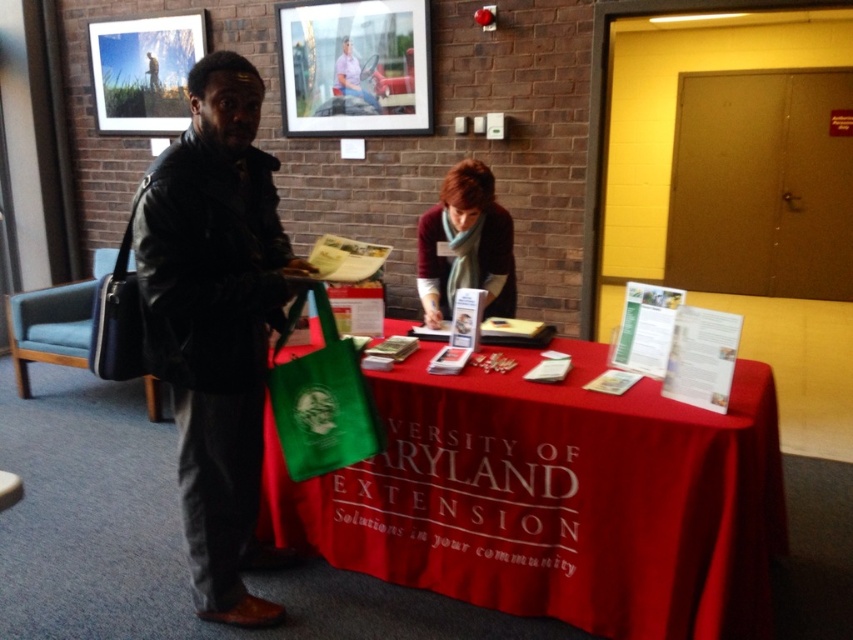
Question: Which object is positioned farthest from the maroon sweater at center?

Choices:
 (A) leather jacket at left
 (B) red cloth at center

Answer: (A)

Question: Which point is closer to the camera?

Choices:
 (A) leather jacket at left
 (B) red cloth at center
 (C) green fabric bag at center

Answer: (A)

Question: Can you confirm if red cloth at center is positioned to the left of leather jacket at left?

Choices:
 (A) yes
 (B) no

Answer: (B)

Question: Which object is positioned closest to the leather jacket at left?

Choices:
 (A) maroon sweater at center
 (B) green fabric bag at center
 (C) red cloth at center

Answer: (B)

Question: Can you confirm if leather jacket at left is thinner than maroon sweater at center?

Choices:
 (A) no
 (B) yes

Answer: (A)

Question: From the image, what is the correct spatial relationship of leather jacket at left in relation to green fabric bag at center?

Choices:
 (A) above
 (B) below

Answer: (A)